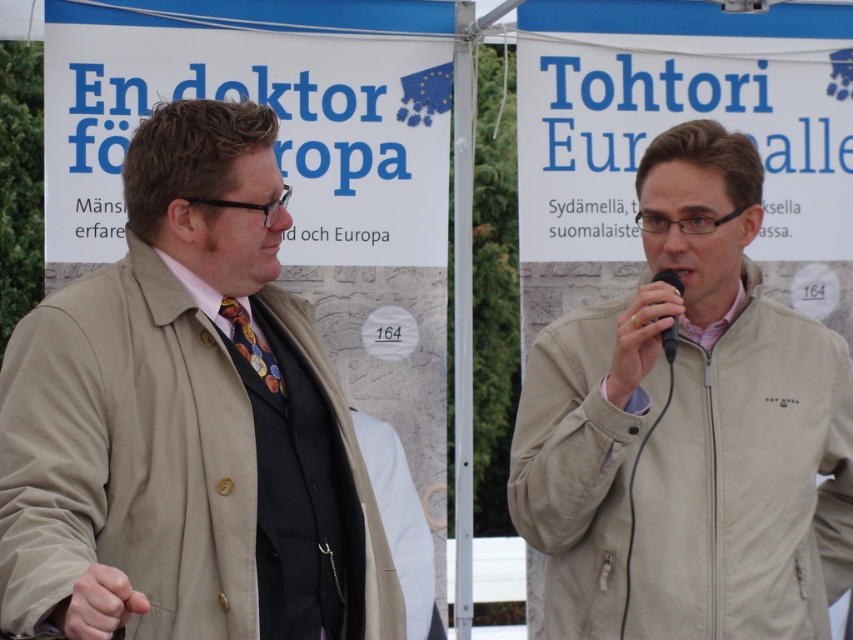
Question: Does beige fabric jacket at right appear under black plastic microphone at center?

Choices:
 (A) no
 (B) yes

Answer: (B)

Question: Estimate the real-world distances between objects in this image. Which object is farther from the black plastic microphone at center?

Choices:
 (A) beige fabric jacket at right
 (B) shiny gold tie at center

Answer: (B)

Question: Can you confirm if shiny gold tie at center is positioned below black plastic microphone at center?

Choices:
 (A) yes
 (B) no

Answer: (A)

Question: Is beige fabric jacket at right bigger than shiny gold tie at center?

Choices:
 (A) no
 (B) yes

Answer: (B)

Question: Which point appears farthest from the camera in this image?

Choices:
 (A) (253, 365)
 (B) (779, 609)
 (C) (41, 380)

Answer: (B)

Question: Which of the following is the closest to the observer?

Choices:
 (A) (242, 349)
 (B) (664, 340)
 (C) (830, 372)

Answer: (A)